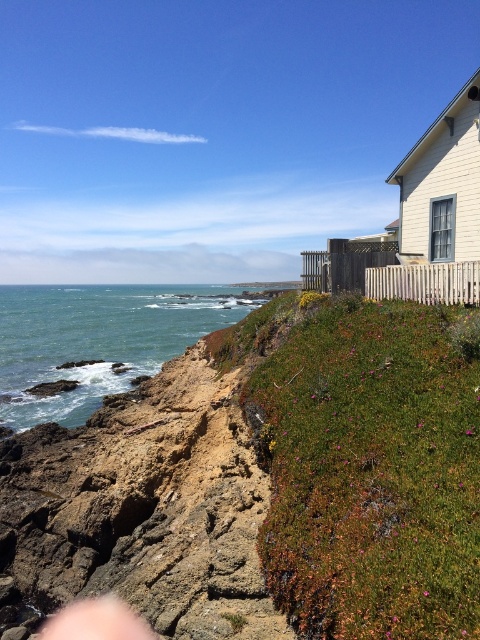
Does green grassy hillside at upper right have a lesser height compared to green water at lower left?

Indeed, green grassy hillside at upper right has a lesser height compared to green water at lower left.

Between green grassy hillside at upper right and green water at lower left, which one is positioned lower?

green grassy hillside at upper right is lower down.

The width and height of the screenshot is (480, 640). What are the coordinates of `green grassy hillside at upper right` in the screenshot? It's located at (365, 465).

This screenshot has width=480, height=640. I want to click on green grassy hillside at upper right, so click(x=365, y=465).